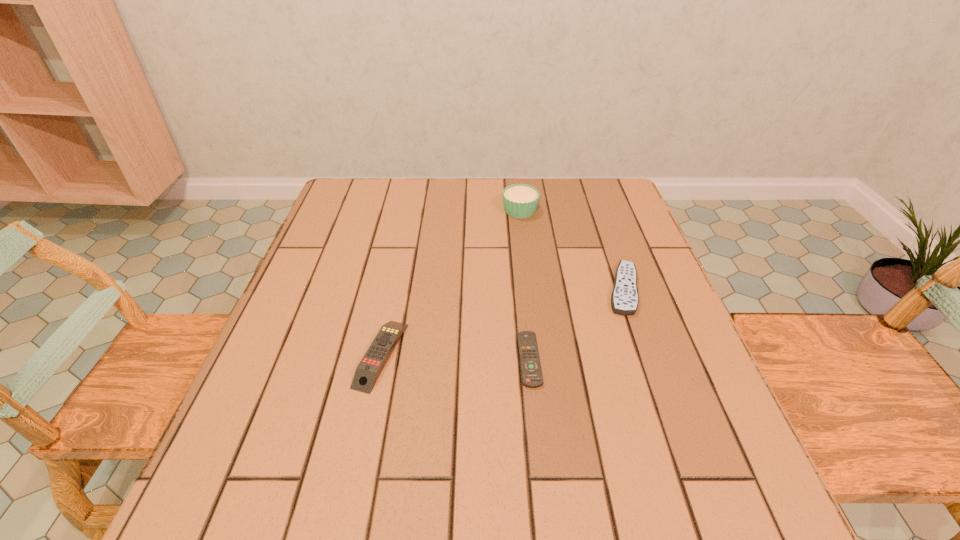
Select which object appears as the third closest to the rightmost object. Please provide its 2D coordinates. Your answer should be formatted as a tuple, i.e. [(x, y)], where the tuple contains the x and y coordinates of a point satisfying the conditions above.

[(367, 371)]

Where is `the closest remote control to the leftmost remote control`? the closest remote control to the leftmost remote control is located at coordinates (531, 371).

Point out which remote control is positioned as the nearest to the leftmost object. Please provide its 2D coordinates. Your answer should be formatted as a tuple, i.e. [(x, y)], where the tuple contains the x and y coordinates of a point satisfying the conditions above.

[(531, 371)]

Identify the location of free point that satisfies the following two spatial constraints: 1. on the front side of the tallest object; 2. on the right side of the rightmost object. (530, 289).

You are a GUI agent. You are given a task and a screenshot of the screen. Output one action in this format:
    pyautogui.click(x=<x>, y=<y>)
    Task: Click on the vacant space that satisfies the following two spatial constraints: 1. on the back side of the second remote control from right to left; 2. on the right side of the second shortest remote control
    This screenshot has height=540, width=960.
    Given the screenshot: What is the action you would take?
    522,289

Image resolution: width=960 pixels, height=540 pixels. What are the coordinates of `free spot that satisfies the following two spatial constraints: 1. on the back side of the leftmost remote control; 2. on the left side of the tallest object` in the screenshot? It's located at (412, 210).